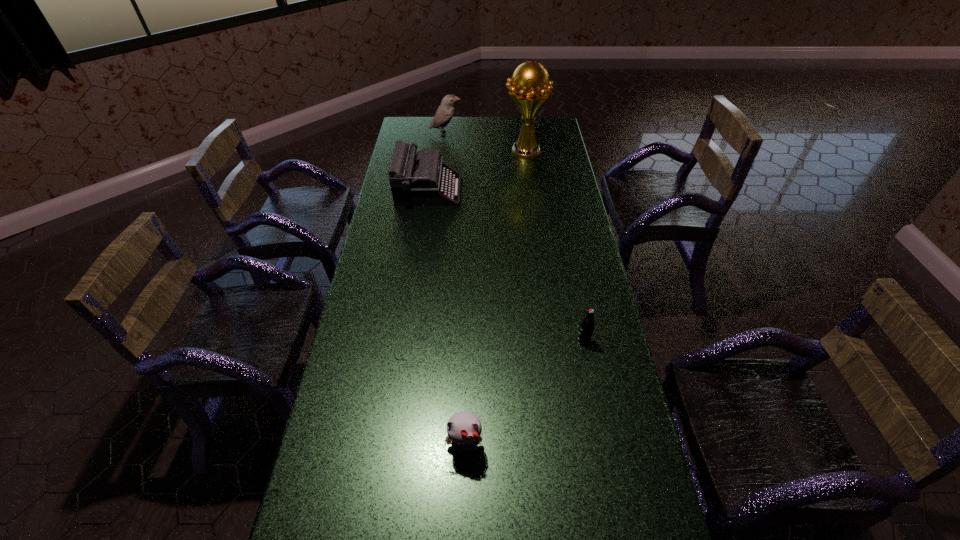
Find the location of a particular element. object that is at the far left corner is located at coordinates tap(445, 112).

This screenshot has width=960, height=540. I want to click on vacant space at the far edge of the desktop, so click(442, 133).

I want to click on free space at the left edge of the desktop, so click(395, 383).

This screenshot has height=540, width=960. What are the coordinates of `vacant space at the right edge of the desktop` in the screenshot? It's located at (558, 244).

Locate an element on the screen. This screenshot has height=540, width=960. vacant space at the far right corner of the desktop is located at coordinates (539, 133).

Identify the location of vacant area that lies between the typewriter and the left kitten. This screenshot has height=540, width=960. (446, 318).

The height and width of the screenshot is (540, 960). Identify the location of free spot between the typewriter and the tallest object. (476, 171).

Where is `vacant space that's between the tallest object and the second nearest object`? vacant space that's between the tallest object and the second nearest object is located at coordinates (494, 299).

I want to click on vacant area between the typewriter and the left kitten, so click(446, 318).

This screenshot has width=960, height=540. I want to click on unoccupied area between the bird and the fourth farthest object, so click(x=514, y=237).